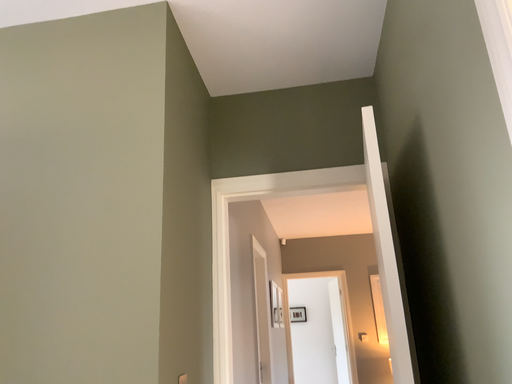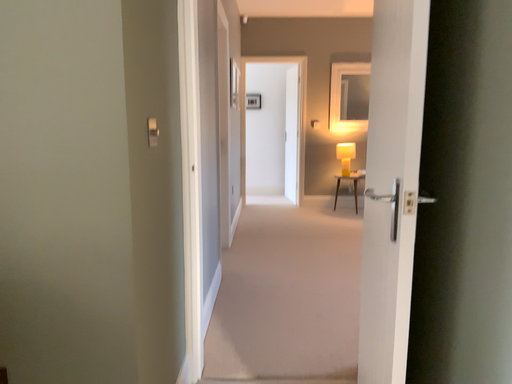
Question: How did the camera likely rotate when shooting the video?

Choices:
 (A) rotated upward
 (B) rotated downward

Answer: (B)